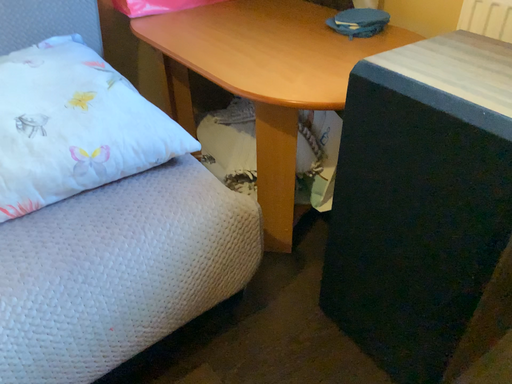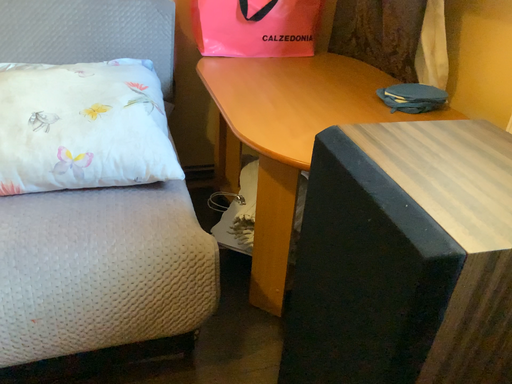
Question: How did the camera likely rotate when shooting the video?

Choices:
 (A) rotated left
 (B) rotated right

Answer: (A)